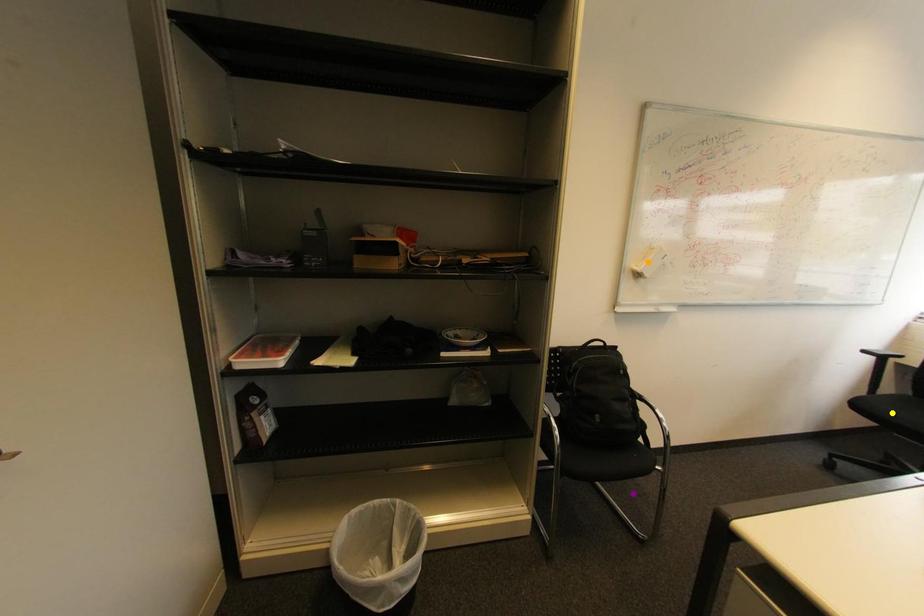
Order these from nearest to farthest:
1. purple point
2. orange point
3. yellow point

yellow point → purple point → orange point